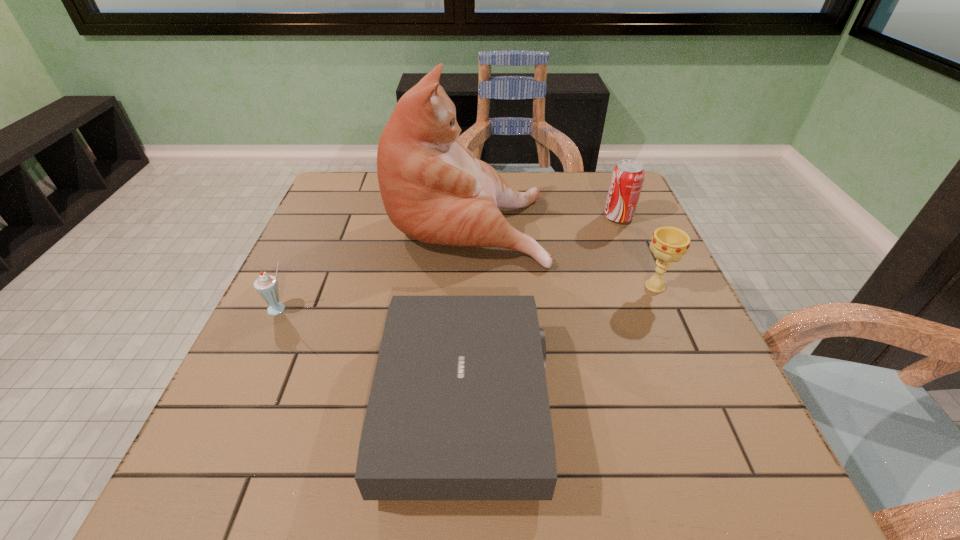
Locate an element on the screen. This screenshot has height=540, width=960. the tallest object is located at coordinates (x=434, y=189).

Find the location of a particular element. The width and height of the screenshot is (960, 540). soda can is located at coordinates (627, 178).

You are a GUI agent. You are given a task and a screenshot of the screen. Output one action in this format:
    pyautogui.click(x=<x>, y=<y>)
    Task: Click on the chalice
    The width and height of the screenshot is (960, 540).
    Given the screenshot: What is the action you would take?
    pyautogui.click(x=669, y=244)

The width and height of the screenshot is (960, 540). Identify the location of the second nearest object. (266, 285).

The image size is (960, 540). Find the location of `the leftmost object`. the leftmost object is located at coordinates (266, 285).

At what (x,y) coordinates should I click in order to perform the action: click on projector. Please return your answer as a coordinate pair (x, y). Looking at the image, I should click on (458, 409).

This screenshot has width=960, height=540. Find the location of `free space located on the face of the cat`. free space located on the face of the cat is located at coordinates (584, 220).

The width and height of the screenshot is (960, 540). Identify the location of vacant space located on the logo side of the soda can. (505, 217).

You are a GUI agent. You are given a task and a screenshot of the screen. Output one action in this format:
    pyautogui.click(x=<x>, y=<y>)
    Task: Click on the free spot located on the logo side of the soda can
    This screenshot has height=540, width=960.
    Given the screenshot: What is the action you would take?
    pyautogui.click(x=530, y=217)

In order to click on free location located 0.200m on the logo side of the soda can in this screenshot , I will do `click(530, 217)`.